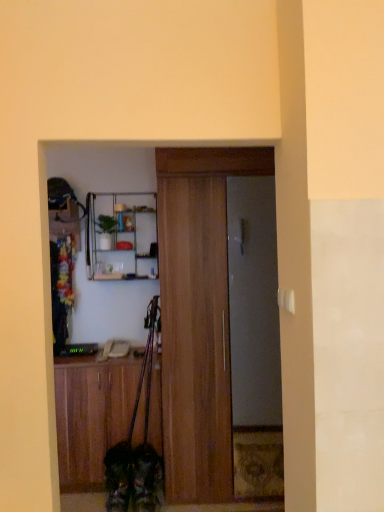
Question: Which direction should I rotate to look at wooden door at center, positioned as the first door in front-to-back order?

Choices:
 (A) left
 (B) right

Answer: (B)

Question: Considering the relative sizes of fluffy brown dog at lower center and wooden door at center, positioned as the first door in front-to-back order, in the image provided, is fluffy brown dog at lower center bigger than wooden door at center, positioned as the first door in front-to-back order,?

Choices:
 (A) yes
 (B) no

Answer: (B)

Question: Considering the relative sizes of fluffy brown dog at lower center and wooden door at center, positioned as the first door in front-to-back order, in the image provided, is fluffy brown dog at lower center wider than wooden door at center, positioned as the first door in front-to-back order,?

Choices:
 (A) no
 (B) yes

Answer: (A)

Question: Considering the relative sizes of fluffy brown dog at lower center and wooden door at center, positioned as the first door in front-to-back order, in the image provided, is fluffy brown dog at lower center smaller than wooden door at center, positioned as the first door in front-to-back order,?

Choices:
 (A) no
 (B) yes

Answer: (B)

Question: Is fluffy brown dog at lower center positioned in front of wooden door at center, which is the second door from back to front?

Choices:
 (A) yes
 (B) no

Answer: (A)

Question: Considering the relative sizes of fluffy brown dog at lower center and wooden door at center, which is the second door from back to front, in the image provided, is fluffy brown dog at lower center shorter than wooden door at center, which is the second door from back to front,?

Choices:
 (A) no
 (B) yes

Answer: (B)

Question: Is fluffy brown dog at lower center not within wooden door at center, positioned as the first door in front-to-back order?

Choices:
 (A) yes
 (B) no

Answer: (A)

Question: Does metallic gray door at center, the 2th door when ordered from front to back, have a greater height compared to fluffy brown dog at lower center?

Choices:
 (A) no
 (B) yes

Answer: (B)

Question: Is metallic gray door at center, the 2th door when ordered from front to back, closer to the viewer compared to fluffy brown dog at lower center?

Choices:
 (A) no
 (B) yes

Answer: (A)

Question: Can you confirm if metallic gray door at center, the 1th door in the back-to-front sequence, is wider than fluffy brown dog at lower center?

Choices:
 (A) no
 (B) yes

Answer: (A)

Question: Is metallic gray door at center, the 2th door when ordered from front to back, oriented towards fluffy brown dog at lower center?

Choices:
 (A) yes
 (B) no

Answer: (B)

Question: Considering the relative sizes of metallic gray door at center, the 1th door in the back-to-front sequence, and fluffy brown dog at lower center in the image provided, is metallic gray door at center, the 1th door in the back-to-front sequence, bigger than fluffy brown dog at lower center?

Choices:
 (A) no
 (B) yes

Answer: (B)

Question: Would you say metallic gray door at center, the 1th door in the back-to-front sequence, contains fluffy brown dog at lower center?

Choices:
 (A) no
 (B) yes

Answer: (A)

Question: Can wooden door at center, which is the second door from back to front, be found inside metallic silver shelf at upper center?

Choices:
 (A) yes
 (B) no

Answer: (B)